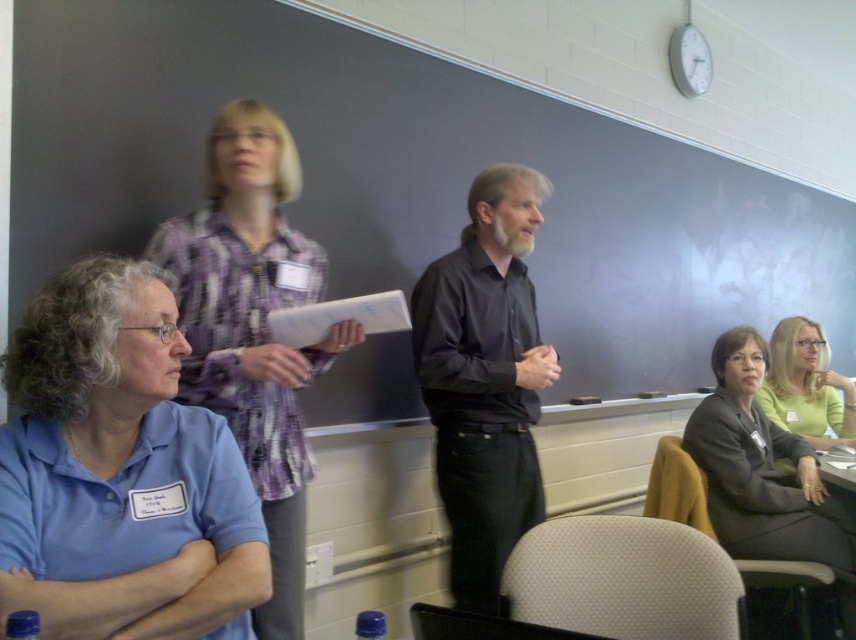
What is the color of the shirt worn by the person located at the coordinates point [484,380]?

The black smooth shirt at center is located at point [484,380], so the color is black.

You are organizing a clothing donation drive and have two shirts to compare. The blue cotton shirt at lower left and the black smooth shirt at center. Which one is smaller in size?

The blue cotton shirt at lower left is smaller in size compared to the black smooth shirt at center according to the description.